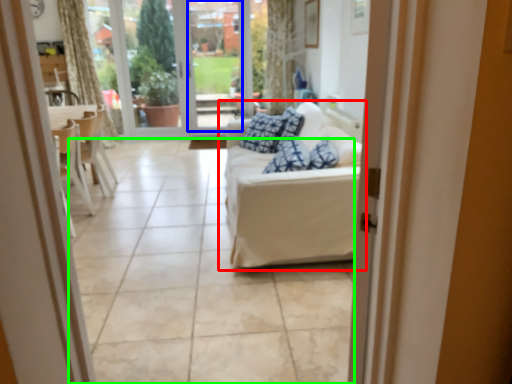
Question: Which is farther away from studio couch (highlighted by a red box)? window screen (highlighted by a blue box) or tile (highlighted by a green box)?

Choices:
 (A) window screen
 (B) tile

Answer: (A)